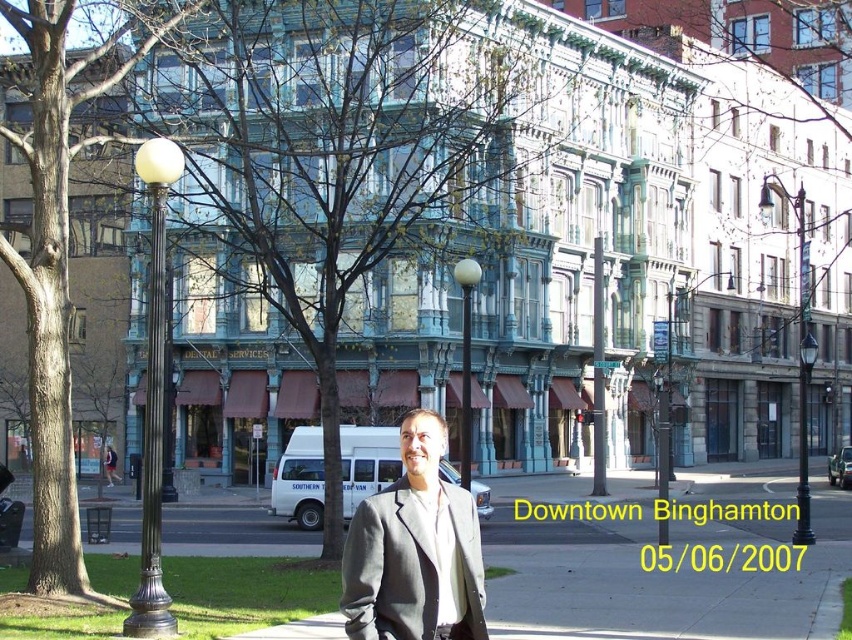
Can you confirm if green leafy tree at center is thinner than gray wool suit at center?

No, green leafy tree at center is not thinner than gray wool suit at center.

Is green leafy tree at center smaller than gray wool suit at center?

Actually, green leafy tree at center might be larger than gray wool suit at center.

Which is in front, point (332, 420) or point (372, 532)?

Point (372, 532)

Locate an element on the screen. Image resolution: width=852 pixels, height=640 pixels. green leafy tree at center is located at coordinates (338, 152).

Can you confirm if brown wood tree at left is smaller than gray wool suit at center?

Actually, brown wood tree at left might be larger than gray wool suit at center.

Between point (68, 104) and point (398, 525), which one is positioned behind?

Point (68, 104)

Does point (41, 182) lie behind point (346, 608)?

Yes, point (41, 182) is farther from viewer.

Where is `brown wood tree at left`? brown wood tree at left is located at coordinates (56, 272).

Is point (323, 72) farther from camera compared to point (43, 188)?

Yes.

Does green leafy tree at center have a greater height compared to brown wood tree at left?

Incorrect, green leafy tree at center's height is not larger of brown wood tree at left's.

What do you see at coordinates (338, 152) in the screenshot? I see `green leafy tree at center` at bounding box center [338, 152].

Identify the location of green leafy tree at center. (338, 152).